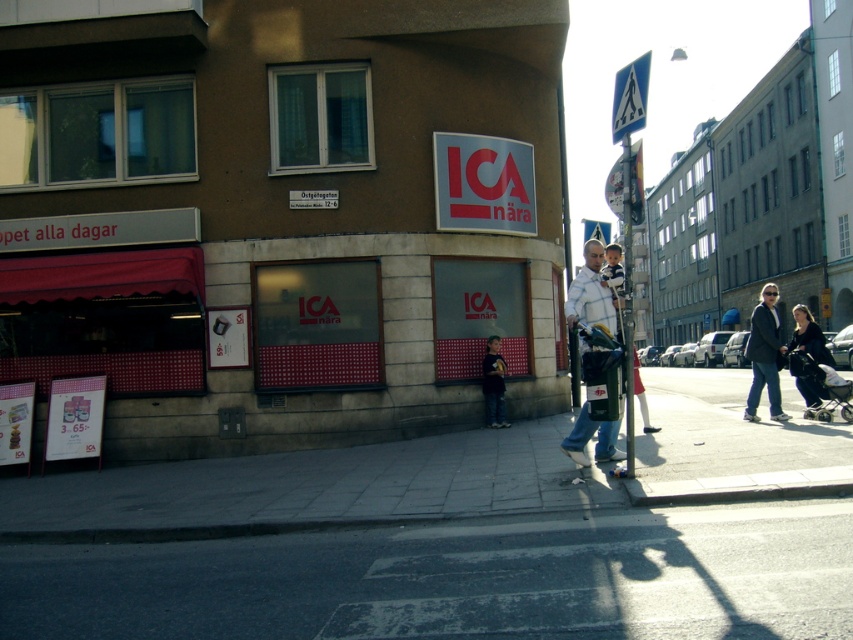
You are a delivery person trying to find the entrance to the ICA supermarket. You see the concrete sidewalk at lower center and the white striped shirt at center. Which object is closer to the building entrance?

The concrete sidewalk at lower center is located below the white striped shirt at center, so the white striped shirt at center is closer to the building entrance.

You are a delivery person trying to locate the dark gray suit at right and denim pants at center. According to the scene, which one is closer to you?

The dark gray suit at right is closer to you because it is in front of the denim pants at center.

You are a delivery person trying to navigate to the ICA supermarket entrance. You see the concrete sidewalk at lower center and the gray fabric baby carriage at lower right. Which object should you approach first to reach the entrance?

The concrete sidewalk at lower center is to the left of the gray fabric baby carriage at lower right. Since the sidewalk is closer to the building entrance, you should approach the concrete sidewalk at lower center first to reach the entrance.